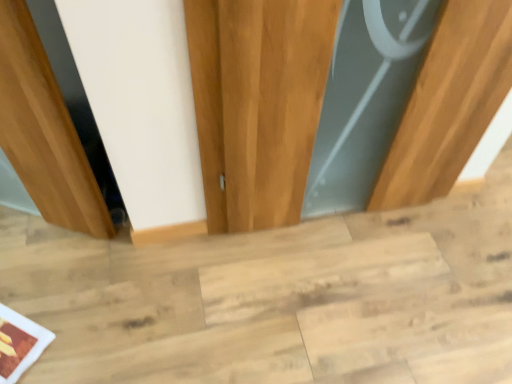
Identify the location of vacant space to the right of wooden door at center. The height and width of the screenshot is (384, 512). (428, 239).